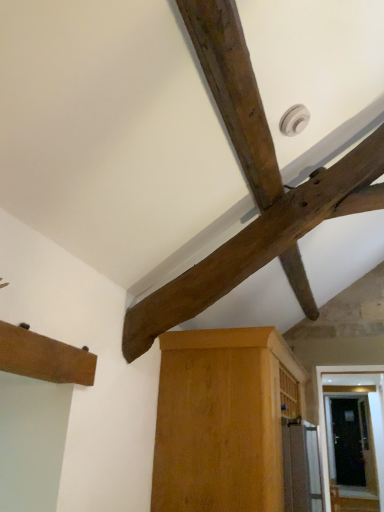
Question: Considering the positions of light brown wood cabinet at center, which is the 1th cabinetry in bottom-to-top order, and dark brown wood beam at upper center in the image, is light brown wood cabinet at center, which is the 1th cabinetry in bottom-to-top order, wider or thinner than dark brown wood beam at upper center?

Choices:
 (A) thin
 (B) wide

Answer: (B)

Question: In terms of height, does light brown wood cabinet at center, which is the 1th cabinetry in bottom-to-top order, look taller or shorter compared to dark brown wood beam at upper center?

Choices:
 (A) short
 (B) tall

Answer: (A)

Question: Estimate the real-world distances between objects in this image. Which object is farther from the brown wood cabinet at lower left, the 2th cabinetry from the right?

Choices:
 (A) light brown wood cabinet at center, which appears as the first cabinetry when viewed from the right
 (B) dark brown wood beam at upper center

Answer: (A)

Question: Estimate the real-world distances between objects in this image. Which object is farther from the light brown wood cabinet at center, which is the 1th cabinetry in bottom-to-top order?

Choices:
 (A) brown wood cabinet at lower left, the first cabinetry from the top
 (B) dark brown wood beam at upper center

Answer: (A)